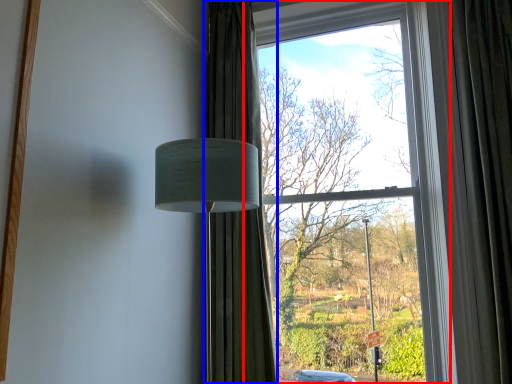
Question: Which point is closer to the camera, window (highlighted by a red box) or curtain (highlighted by a blue box)?

Choices:
 (A) window
 (B) curtain

Answer: (A)